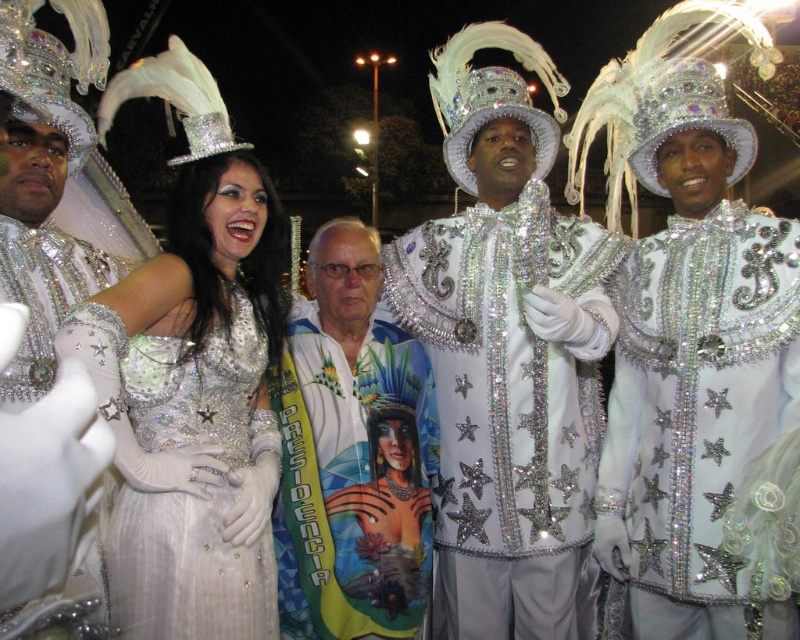
Question: From the image, what is the correct spatial relationship of sparkly silver dress at center in relation to satin/sequined dress at center?

Choices:
 (A) above
 (B) below

Answer: (A)

Question: Where is glittery silver jacket at center located in relation to satin/sequined dress at center in the image?

Choices:
 (A) right
 (B) left

Answer: (A)

Question: Which of the following is the farthest from the observer?

Choices:
 (A) (614, 513)
 (B) (472, 397)

Answer: (B)

Question: Which point is farther from the camera taking this photo?

Choices:
 (A) (278, 451)
 (B) (256, 580)
 (C) (682, 289)

Answer: (A)

Question: Among these objects, which one is nearest to the camera?

Choices:
 (A) satin/sequined dress at center
 (B) sparkly silver dress at center
 (C) sparkly silver jacket at center

Answer: (B)

Question: Is sparkly silver dress at center above satin/sequined dress at center?

Choices:
 (A) no
 (B) yes

Answer: (B)